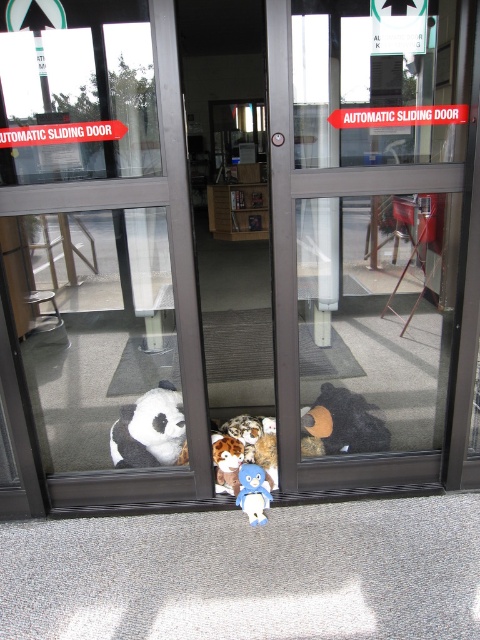
You are a delivery person approaching the automatic sliding doors. You need to place a new toy on the ground in front of the doors, but you must ensure it doesn not block the path. The white plush at lower left and the fluffy plush bear at center are already there. Which existing toy is closer to you, so you can place the new toy behind it to avoid blocking the entrance?

The white plush at lower left is closer to you than the fluffy plush bear at center. Placing the new toy behind the white plush at lower left would keep it out of the entrance path.

You are a delivery person approaching the automatic sliding doors. You see a white plush at lower left and a blue plush toy at center. Which plush toy is closer to the doors?

The white plush at lower left is closer to the doors because the blue plush toy at center is behind it.

You are standing at the camera position and want to pick up the plush toy located at point (x=235, y=451). Can you reach it without moving your feet?

The point (x=235, y=451) is 7.51 feet away from the camera, so you cannot reach it without moving your feet since that distance is beyond typical human reach.